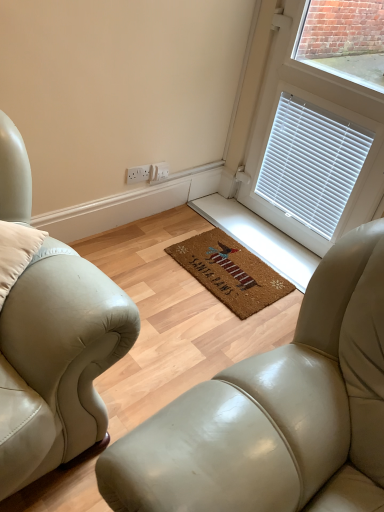
You are a GUI agent. You are given a task and a screenshot of the screen. Output one action in this format:
    pyautogui.click(x=<x>, y=<y>)
    Task: Click on the free spot above brown coir mat at center (from a real-world perspective)
    The height and width of the screenshot is (512, 384).
    Given the screenshot: What is the action you would take?
    pyautogui.click(x=240, y=264)